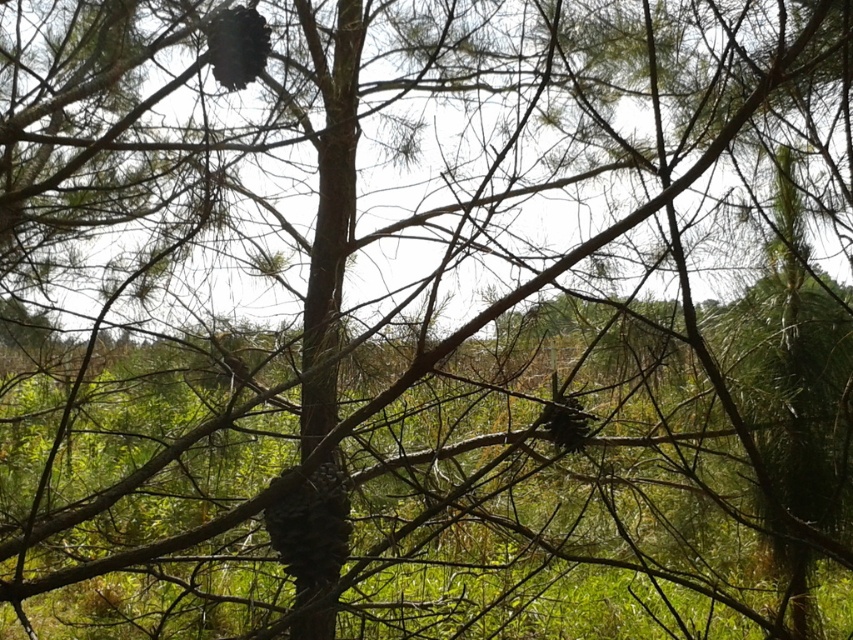
Consider the image. Can you confirm if brown rough pine cone at center is positioned below dark brown textured pine cone at upper center?

Indeed, brown rough pine cone at center is positioned under dark brown textured pine cone at upper center.

Is brown rough pine cone at center thinner than dark brown textured pine cone at upper center?

Incorrect, brown rough pine cone at center's width is not less than dark brown textured pine cone at upper center's.

Who is more distant from viewer, (x=312, y=515) or (x=256, y=28)?

The point (x=312, y=515) is more distant.

At what (x,y) coordinates should I click in order to perform the action: click on brown rough pine cone at center. Please return your answer as a coordinate pair (x, y). Looking at the image, I should click on (311, 531).